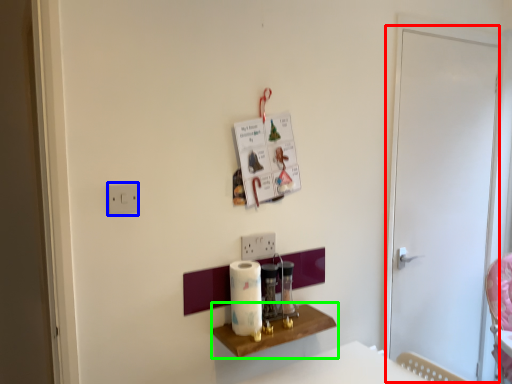
Question: Considering the real-world distances, which object is closest to screen door (highlighted by a red box)? light switch (highlighted by a blue box) or furniture (highlighted by a green box).

Choices:
 (A) light switch
 (B) furniture

Answer: (B)